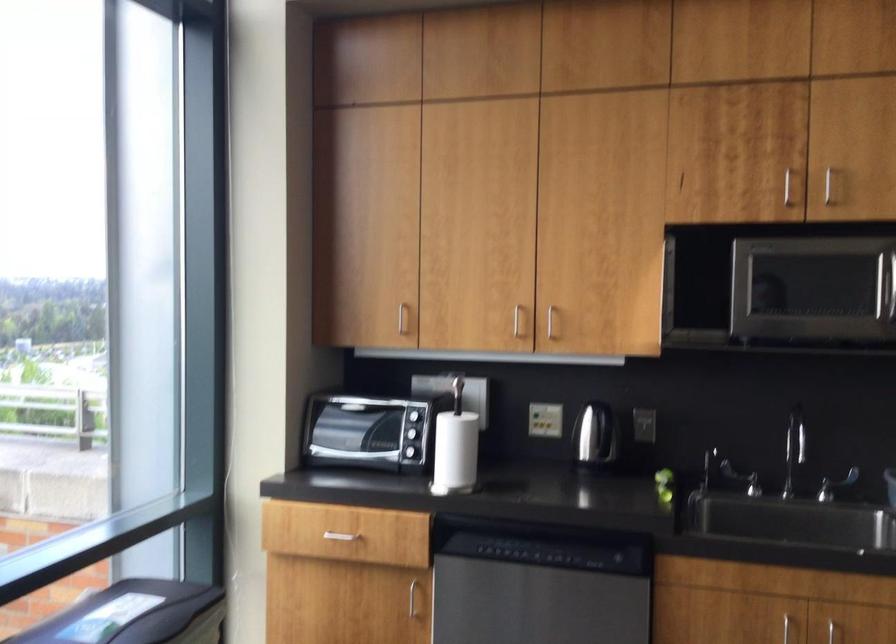
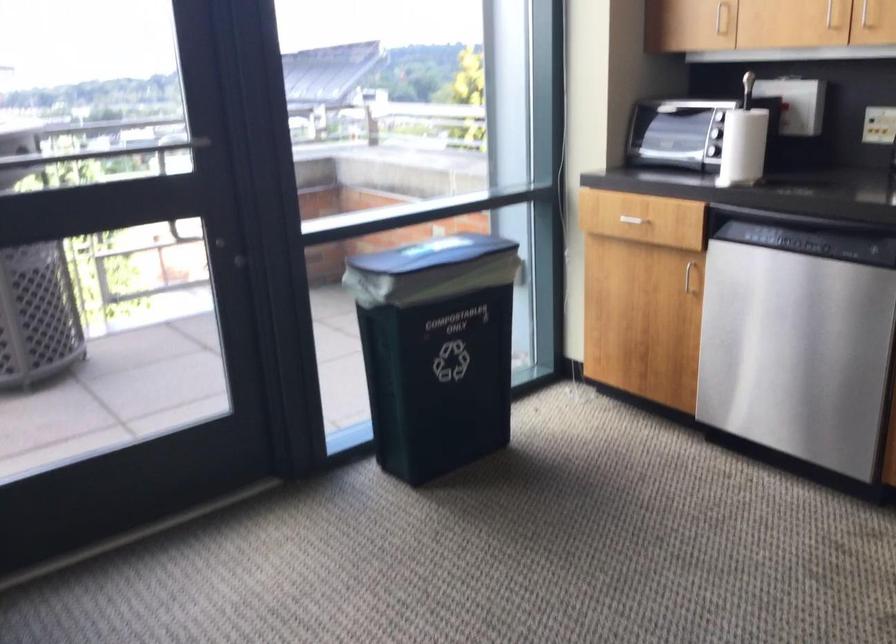
How did the camera likely rotate?

The camera rotated toward left-down.